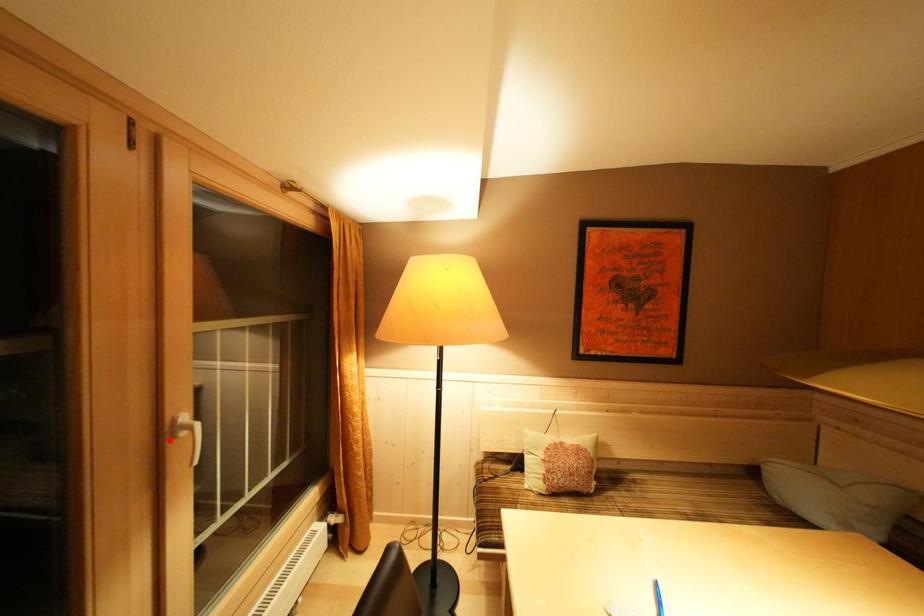
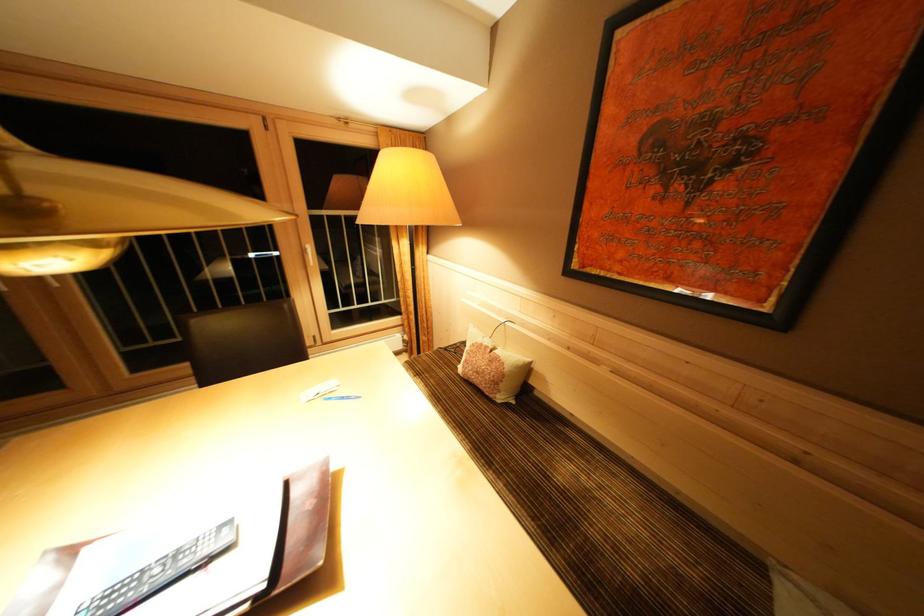
Question: I am providing you with two images of the same scene from different viewpoints. A red point is shown in image1. For the corresponding object point in image2, is it positioned nearer or farther from the camera?

Choices:
 (A) Nearer
 (B) Farther

Answer: (A)